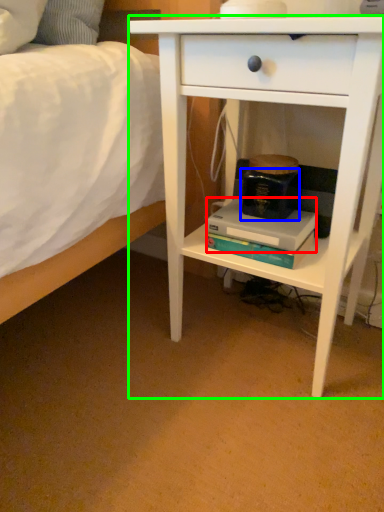
Question: Which object is the closest to the paperback book (highlighted by a red box)? Choose among these: paperback book (highlighted by a blue box) or nightstand (highlighted by a green box).

Choices:
 (A) paperback book
 (B) nightstand

Answer: (A)